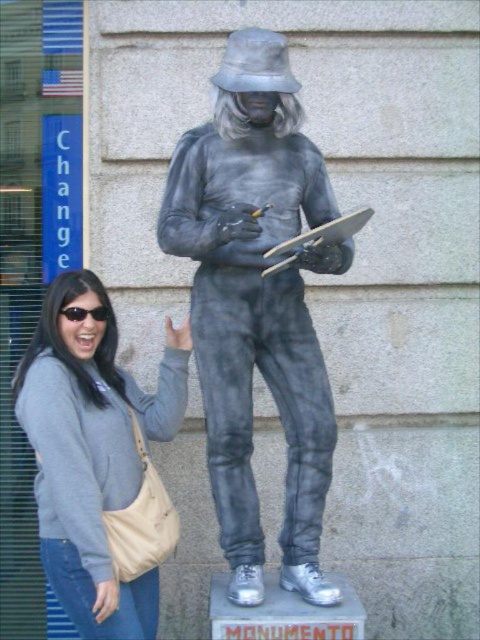
You are a photographer trying to capture the statue of the gray metallic figure at center in the image. The statue is located at point (x=256, y=305). If you want to include the woman in the frame without moving the camera, where should you position her relative to the statue?

The gray metallic figure at center is located at point (x=256, y=305). To include the woman in the frame without moving the camera, position her to the left of the statue, as she is currently standing to the left of the statue.

You are a photographer trying to capture both the gray metallic figure at center and the gray fabric sweatshirt at left in a single shot. Which object should you focus on first to ensure both are in focus?

You should focus on the gray metallic figure at center first since it is closer to the viewer than the gray fabric sweatshirt at left, ensuring that both will be in focus when focusing on the closer object.

You are a photographer trying to capture both the gray metallic figure at center and the gray fabric sweatshirt at left in a single frame. Since the statue is wider than the woman, which object should you position closer to the camera to ensure both fit in the photo?

Since the gray metallic figure at center is wider than the gray fabric sweatshirt at left, you should position the gray fabric sweatshirt at left closer to the camera to ensure both fit in the photo.